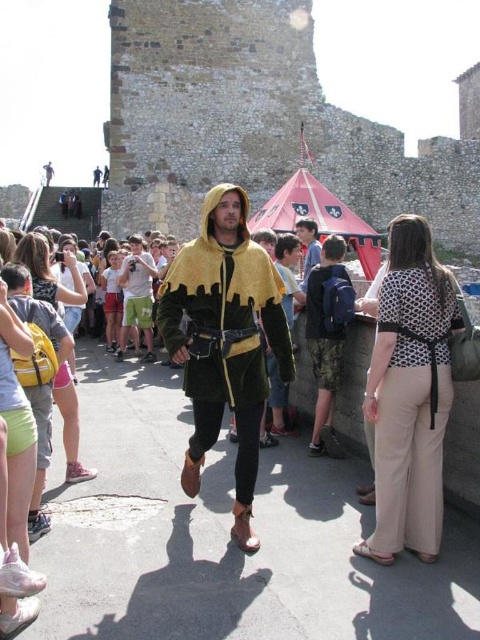
Does green fabric shirt at center have a greater width compared to green leather jacket at center?

Yes, green fabric shirt at center is wider than green leather jacket at center.

Find the location of a particular element. green fabric shirt at center is located at coordinates (136, 296).

Between white dotted shirt at right and green fabric shirt at center, which one is positioned higher?

green fabric shirt at center is higher up.

What are the coordinates of `white dotted shirt at right` in the screenshot? It's located at (408, 413).

Who is more forward, (404, 378) or (140, 289)?

Point (404, 378) is in front.

This screenshot has height=640, width=480. I want to click on white dotted shirt at right, so click(x=408, y=413).

Does velvet yellow cape at center have a smaller size compared to white dotted shirt at right?

No.

Is velvet yellow cape at center below white dotted shirt at right?

Incorrect, velvet yellow cape at center is not positioned below white dotted shirt at right.

Is point (214, 426) positioned in front of point (386, 406)?

No, (214, 426) is behind (386, 406).

Where is `velvet yellow cape at center`? Image resolution: width=480 pixels, height=640 pixels. velvet yellow cape at center is located at coordinates (225, 339).